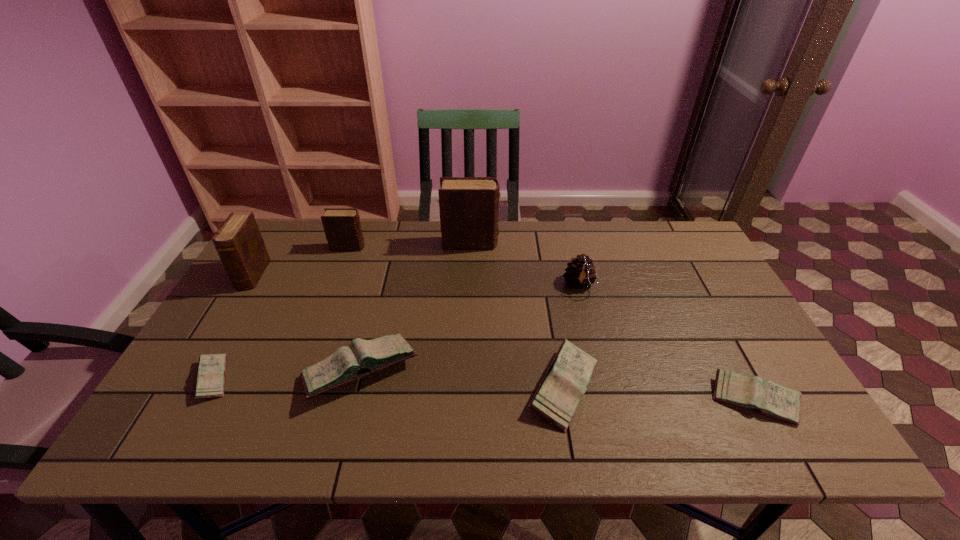
The width and height of the screenshot is (960, 540). I want to click on the tallest object, so (x=469, y=206).

What are the coordinates of `the rightmost brown diary` in the screenshot? It's located at (469, 206).

The image size is (960, 540). Find the location of `the second biggest brown diary`. the second biggest brown diary is located at coordinates (238, 241).

Locate an element on the screen. This screenshot has height=540, width=960. the seventh shortest object is located at coordinates (238, 241).

Identify the location of the second brown diary from right to left. This screenshot has height=540, width=960. (342, 227).

Find the location of a particular element. This screenshot has width=960, height=540. the smallest brown diary is located at coordinates (342, 227).

The width and height of the screenshot is (960, 540). I want to click on brown pinecone, so click(580, 273).

You are a GUI agent. You are given a task and a screenshot of the screen. Output one action in this format:
    pyautogui.click(x=<x>, y=<y>)
    Task: Click on the pinecone
    This screenshot has width=960, height=540.
    Given the screenshot: What is the action you would take?
    pyautogui.click(x=580, y=273)

Where is `the second pink diary from left to right`? This screenshot has height=540, width=960. the second pink diary from left to right is located at coordinates (363, 357).

Locate an element on the screen. Image resolution: width=960 pixels, height=540 pixels. the biggest pink diary is located at coordinates (363, 357).